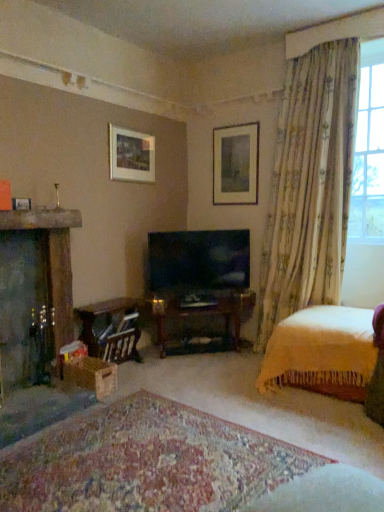
Question: Can you confirm if matte white picture frame at upper center, the 2th picture frame when ordered from back to front, is bigger than yellow knitted blanket at lower right?

Choices:
 (A) yes
 (B) no

Answer: (B)

Question: From the image's perspective, would you say matte white picture frame at upper center, the second picture frame in the front-to-back sequence, is shown under yellow knitted blanket at lower right?

Choices:
 (A) no
 (B) yes

Answer: (A)

Question: Could you tell me if matte white picture frame at upper center, the second picture frame in the front-to-back sequence, is facing yellow knitted blanket at lower right?

Choices:
 (A) no
 (B) yes

Answer: (A)

Question: Does matte white picture frame at upper center, the second picture frame in the front-to-back sequence, lie in front of yellow knitted blanket at lower right?

Choices:
 (A) no
 (B) yes

Answer: (A)

Question: Is matte white picture frame at upper center, which is the second picture frame from left to right, outside of yellow knitted blanket at lower right?

Choices:
 (A) yes
 (B) no

Answer: (A)

Question: Is floral fabric curtain at upper right taller or shorter than wooden table at lower left?

Choices:
 (A) tall
 (B) short

Answer: (A)

Question: Which is correct: floral fabric curtain at upper right is inside wooden table at lower left, or outside of it?

Choices:
 (A) outside
 (B) inside

Answer: (A)

Question: From a real-world perspective, is floral fabric curtain at upper right positioned above or below wooden table at lower left?

Choices:
 (A) below
 (B) above

Answer: (B)

Question: Considering the positions of point (344, 111) and point (137, 340), is point (344, 111) closer or farther from the camera than point (137, 340)?

Choices:
 (A) farther
 (B) closer

Answer: (B)

Question: From the image's perspective, is wooden table at lower left positioned above or below matte black tv at center?

Choices:
 (A) above
 (B) below

Answer: (B)

Question: Considering the relative positions of wooden table at lower left and matte black tv at center in the image provided, is wooden table at lower left to the left or to the right of matte black tv at center?

Choices:
 (A) left
 (B) right

Answer: (A)

Question: Is wooden table at lower left spatially inside matte black tv at center, or outside of it?

Choices:
 (A) outside
 (B) inside

Answer: (A)

Question: Is wooden table at lower left in front of or behind matte black tv at center in the image?

Choices:
 (A) front
 (B) behind

Answer: (A)

Question: Is yellow knitted blanket at lower right bigger or smaller than matte white picture frame at upper center, the 1th picture frame positioned from the right?

Choices:
 (A) big
 (B) small

Answer: (A)

Question: In the image, is yellow knitted blanket at lower right positioned in front of or behind matte white picture frame at upper center, arranged as the third picture frame when viewed from the left?

Choices:
 (A) front
 (B) behind

Answer: (A)